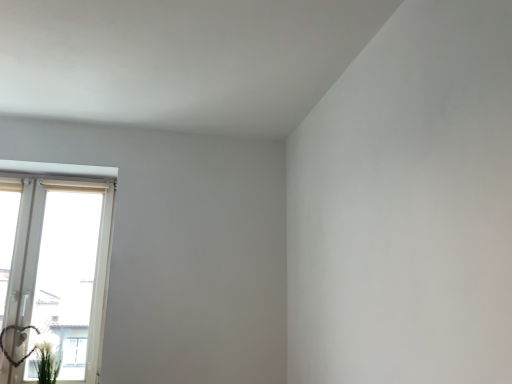
Question: Based on their sizes in the image, would you say white plastic window at left is bigger or smaller than green leafy plant at lower left?

Choices:
 (A) small
 (B) big

Answer: (B)

Question: Is white plastic window at left in front of or behind green leafy plant at lower left in the image?

Choices:
 (A) front
 (B) behind

Answer: (B)

Question: Considering the positions of white plastic window at left and green leafy plant at lower left in the image, is white plastic window at left taller or shorter than green leafy plant at lower left?

Choices:
 (A) tall
 (B) short

Answer: (A)

Question: Choose the correct answer: Is green leafy plant at lower left inside white plastic window at left or outside it?

Choices:
 (A) outside
 (B) inside

Answer: (A)

Question: Considering the positions of green leafy plant at lower left and white plastic window at left in the image, is green leafy plant at lower left wider or thinner than white plastic window at left?

Choices:
 (A) thin
 (B) wide

Answer: (B)

Question: Is green leafy plant at lower left in front of or behind white plastic window at left in the image?

Choices:
 (A) behind
 (B) front

Answer: (B)

Question: From their relative heights in the image, would you say green leafy plant at lower left is taller or shorter than white plastic window at left?

Choices:
 (A) tall
 (B) short

Answer: (B)